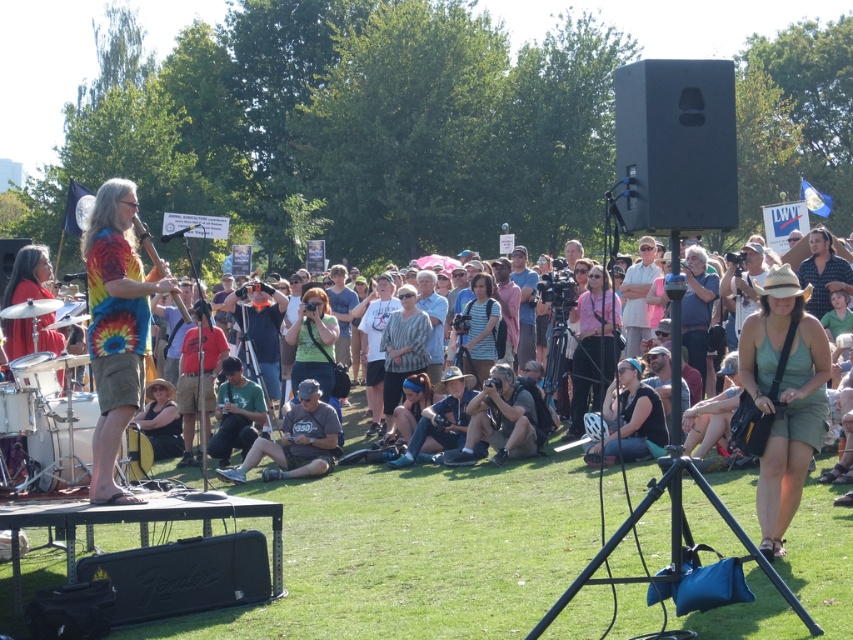
Question: Estimate the real-world distances between objects in this image. Which object is farther from the gray cotton shirt at center?

Choices:
 (A) black fabric at center
 (B) green fabric dress at center

Answer: (B)

Question: Considering the relative positions of green fabric dress at center and black fabric at center in the image provided, where is green fabric dress at center located with respect to black fabric at center?

Choices:
 (A) below
 (B) above

Answer: (B)

Question: Which point is farther from the camera taking this photo?

Choices:
 (A) [x=315, y=445]
 (B) [x=165, y=289]
 (C) [x=659, y=413]
 (D) [x=753, y=316]

Answer: (A)

Question: Estimate the real-world distances between objects in this image. Which object is farther from the green fabric dress at center?

Choices:
 (A) black fabric at center
 (B) tie-dye fabric shirt at left

Answer: (A)

Question: Is green fabric dress at center positioned in front of gray cotton shirt at center?

Choices:
 (A) yes
 (B) no

Answer: (A)

Question: Does tie-dye fabric shirt at left have a smaller size compared to black fabric at center?

Choices:
 (A) yes
 (B) no

Answer: (A)